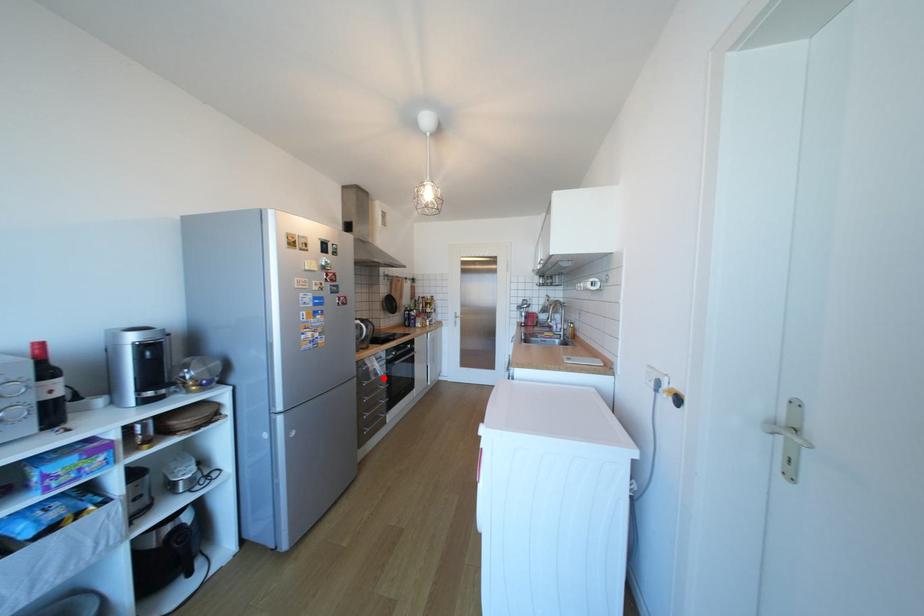
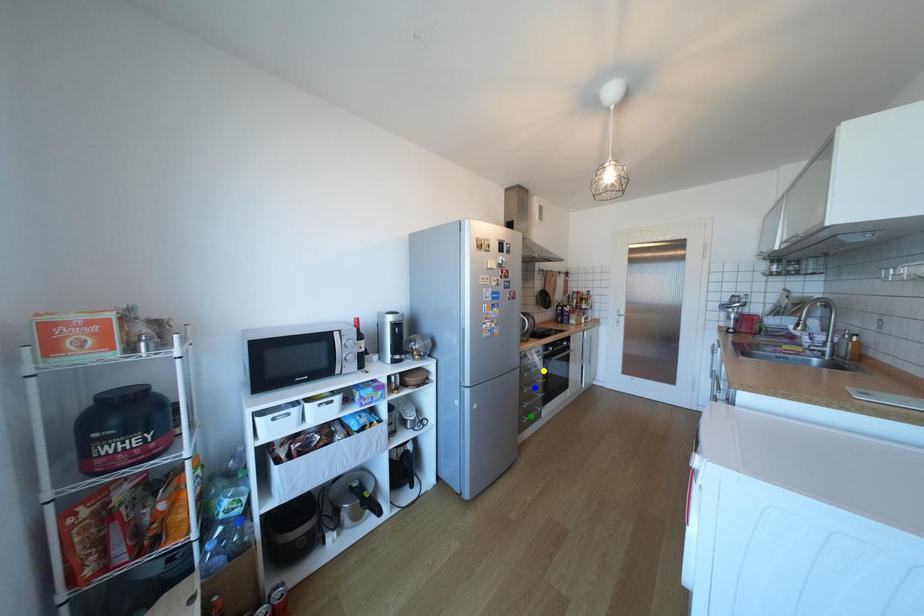
Question: I am providing you with two images of the same scene from different viewpoints. A red point is marked on the first image. You are given multiple points on the second image. Which spot in image 2 lines up with the point in image 1?

Choices:
 (A) green point
 (B) blue point
 (C) yellow point

Answer: (C)